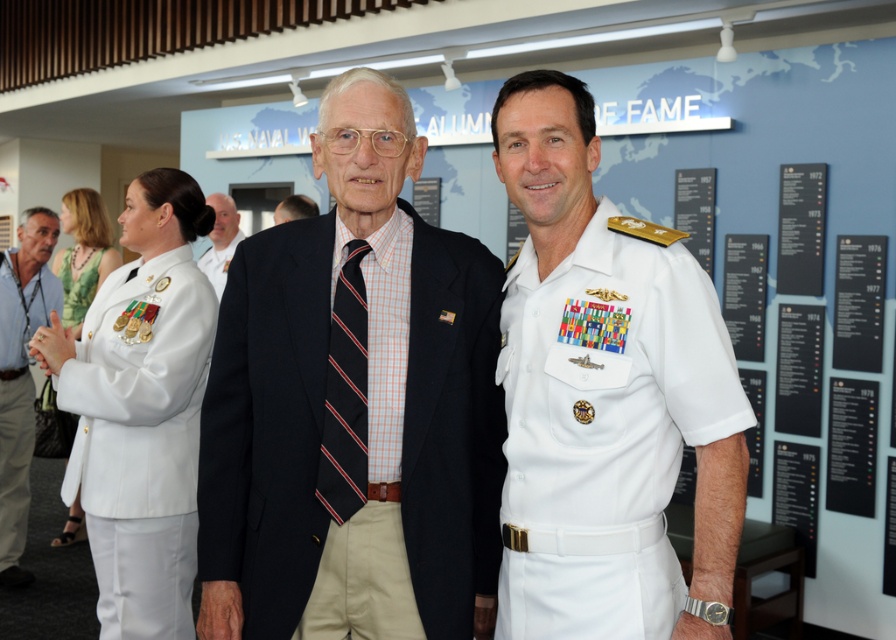
Between white uniform at center and blue shirt at left, which one has less height?

white uniform at center

How much distance is there between white uniform at center and blue shirt at left?

A distance of 3.96 meters exists between white uniform at center and blue shirt at left.

Measure the distance between point (735, 541) and camera.

Point (735, 541) is 1.99 meters from camera.

The width and height of the screenshot is (896, 640). I want to click on white uniform at center, so click(326, 365).

Does white uniform at center appear under white cotton shirt at center?

No, white uniform at center is not below white cotton shirt at center.

Measure the distance between white uniform at center and white cotton shirt at center.

white uniform at center is 11.70 inches away from white cotton shirt at center.

Where is `white uniform at center`? white uniform at center is located at coordinates (326, 365).

Which is above, navy blue fabric suit at center or matte black suit at center?

matte black suit at center is higher up.

Find the location of a particular element. navy blue fabric suit at center is located at coordinates (266, 424).

Is point (322, 324) closer to viewer compared to point (224, 211)?

That is True.

The image size is (896, 640). What are the coordinates of `navy blue fabric suit at center` in the screenshot? It's located at (266, 424).